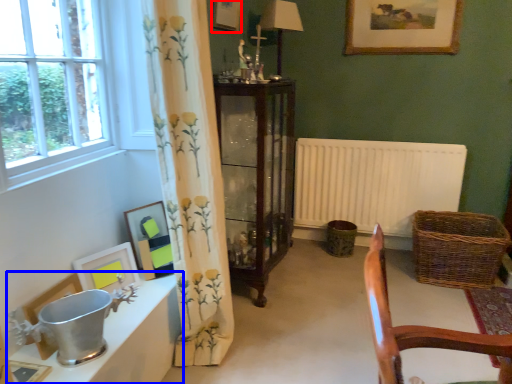
Question: Which object appears farthest to the camera in this image, picture frame (highlighted by a red box) or table (highlighted by a blue box)?

Choices:
 (A) picture frame
 (B) table

Answer: (A)